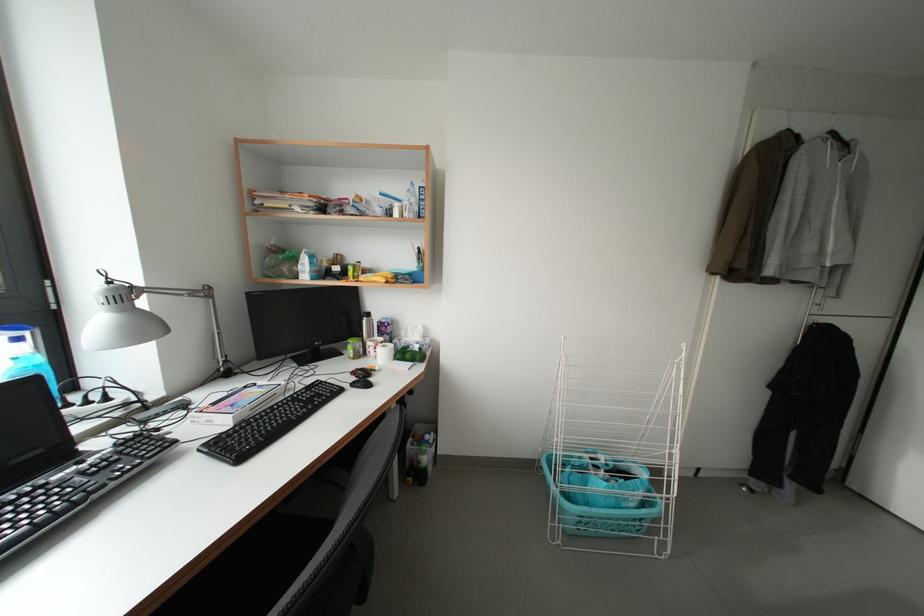
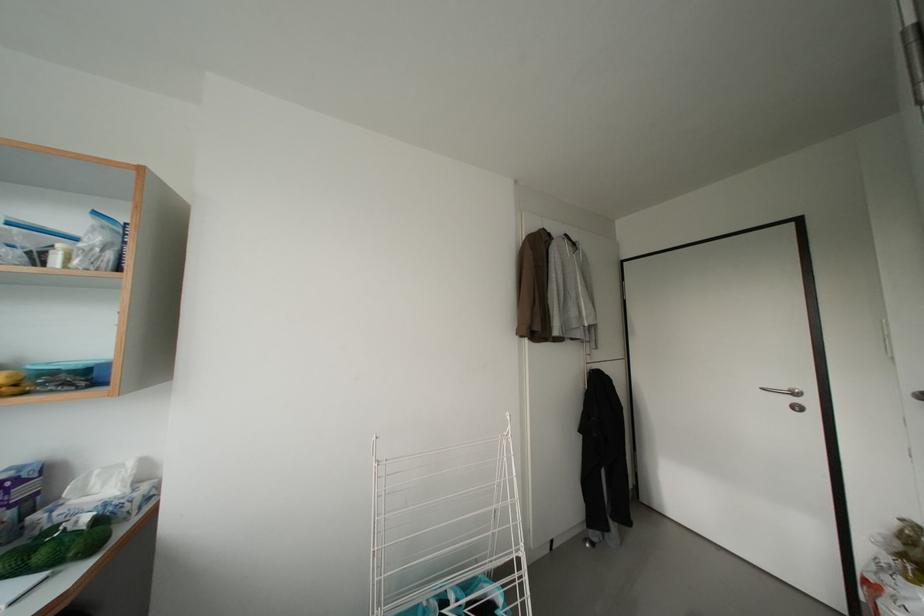
Question: The camera is either moving clockwise (left) or counter-clockwise (right) around the object. The first image is from the beginning of the video and the second image is from the end. Is the camera moving left or right when shooting the video?

Choices:
 (A) Left
 (B) Right

Answer: (A)